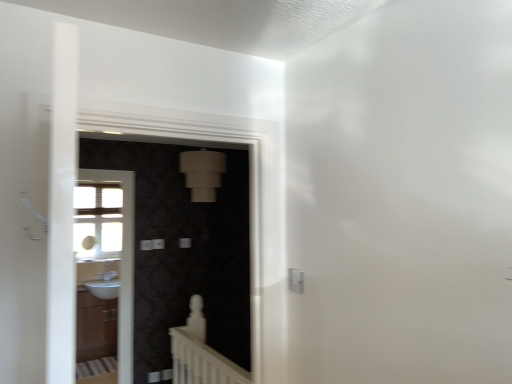
Question: Considering the relative positions of white glossy sink at lower left and white glossy sink at left, acting as the 1th screen door starting from the back, in the image provided, is white glossy sink at lower left to the left of white glossy sink at left, acting as the 1th screen door starting from the back, from the viewer's perspective?

Choices:
 (A) no
 (B) yes

Answer: (B)

Question: Considering the relative sizes of white glossy sink at lower left and white glossy sink at left, acting as the 1th screen door starting from the back, in the image provided, is white glossy sink at lower left thinner than white glossy sink at left, acting as the 1th screen door starting from the back,?

Choices:
 (A) no
 (B) yes

Answer: (A)

Question: From a real-world perspective, is white glossy sink at lower left on white glossy sink at left, acting as the 1th screen door starting from the back?

Choices:
 (A) no
 (B) yes

Answer: (A)

Question: From a real-world perspective, is white glossy sink at lower left under white glossy sink at left, acting as the 1th screen door starting from the back?

Choices:
 (A) yes
 (B) no

Answer: (A)

Question: Is white glossy sink at lower left positioned in front of white glossy sink at left, arranged as the 2th screen door when viewed from the front?

Choices:
 (A) no
 (B) yes

Answer: (A)

Question: Is white glossy sink at lower left oriented towards white glossy sink at left, arranged as the 2th screen door when viewed from the front?

Choices:
 (A) no
 (B) yes

Answer: (B)

Question: Can you confirm if white glossy sink at left, placed as the 2th screen door when sorted from right to left, is positioned to the left of white matte balustrade at lower center?

Choices:
 (A) yes
 (B) no

Answer: (A)

Question: Is white glossy sink at left, arranged as the 2th screen door when viewed from the front, positioned behind white matte balustrade at lower center?

Choices:
 (A) no
 (B) yes

Answer: (B)

Question: Can you confirm if white glossy sink at left, placed as the 2th screen door when sorted from right to left, is thinner than white matte balustrade at lower center?

Choices:
 (A) yes
 (B) no

Answer: (A)

Question: Does white glossy sink at left, acting as the 1th screen door starting from the back, turn towards white matte balustrade at lower center?

Choices:
 (A) no
 (B) yes

Answer: (B)

Question: From the image's perspective, is white glossy sink at left, marked as the first screen door in a left-to-right arrangement, located beneath white matte balustrade at lower center?

Choices:
 (A) no
 (B) yes

Answer: (A)

Question: Is white glossy sink at left, placed as the 2th screen door when sorted from right to left, positioned before white matte balustrade at lower center?

Choices:
 (A) no
 (B) yes

Answer: (A)

Question: From the image's perspective, does matte black screen door at center, the 2th screen door positioned from the back, appear higher than white matte balustrade at lower center?

Choices:
 (A) no
 (B) yes

Answer: (B)